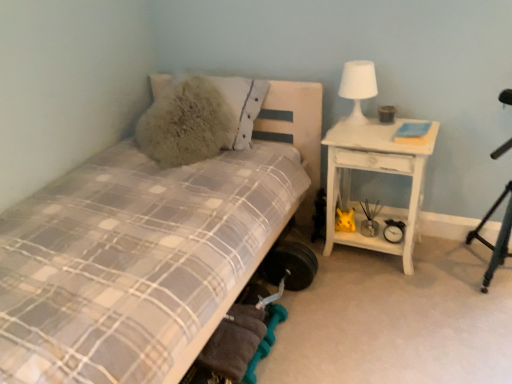
Question: Would you say fuzzy beige pillow at upper left is to the left or to the right of white wood nightstand at right in the picture?

Choices:
 (A) left
 (B) right

Answer: (A)

Question: Relative to white wood nightstand at right, is fuzzy beige pillow at upper left in front or behind?

Choices:
 (A) behind
 (B) front

Answer: (A)

Question: Considering the real-world distances, which object is closest to the white wood nightstand at right?

Choices:
 (A) fuzzy beige pillow at upper left
 (B) plaid fabric bed at left
 (C) teal metallic tripod at right
 (D) white matte table lamp at upper right

Answer: (D)

Question: Estimate the real-world distances between objects in this image. Which object is farther from the white matte table lamp at upper right?

Choices:
 (A) plaid fabric bed at left
 (B) fuzzy beige pillow at upper left
 (C) teal metallic tripod at right
 (D) white wood nightstand at right

Answer: (A)